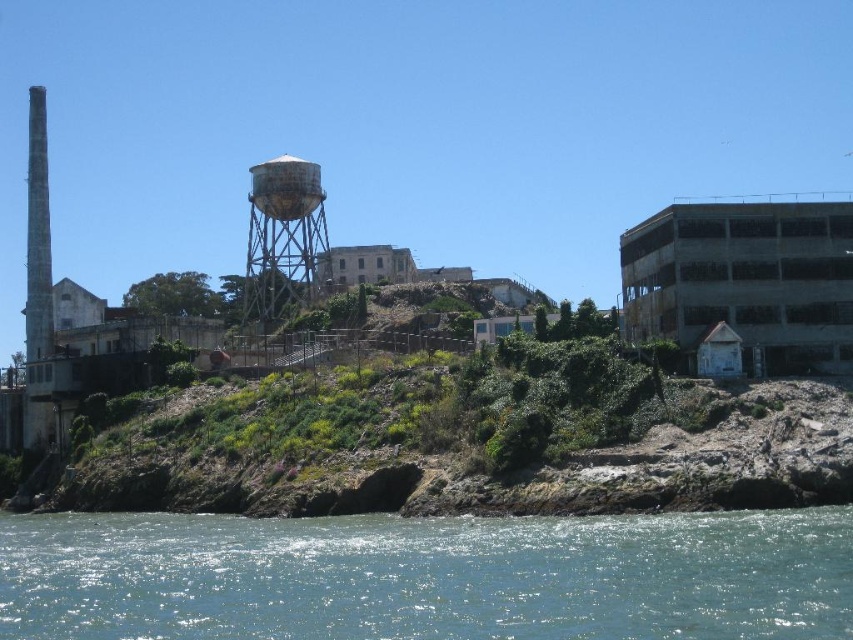
Question: Is clear blue water at lower left to the right of rusty metal water tower at center from the viewer's perspective?

Choices:
 (A) yes
 (B) no

Answer: (A)

Question: Can you confirm if clear blue water at lower left is positioned to the right of rusty metal water tower at center?

Choices:
 (A) yes
 (B) no

Answer: (A)

Question: Is clear blue water at lower left above rusty metal water tower at center?

Choices:
 (A) no
 (B) yes

Answer: (A)

Question: Which point appears farthest from the camera in this image?

Choices:
 (A) (70, 592)
 (B) (270, 177)

Answer: (B)

Question: Which object appears farthest from the camera in this image?

Choices:
 (A) rusty metal water tower at center
 (B) clear blue water at lower left

Answer: (A)

Question: Among these objects, which one is farthest from the camera?

Choices:
 (A) rusty metal water tower at center
 (B) clear blue water at lower left

Answer: (A)